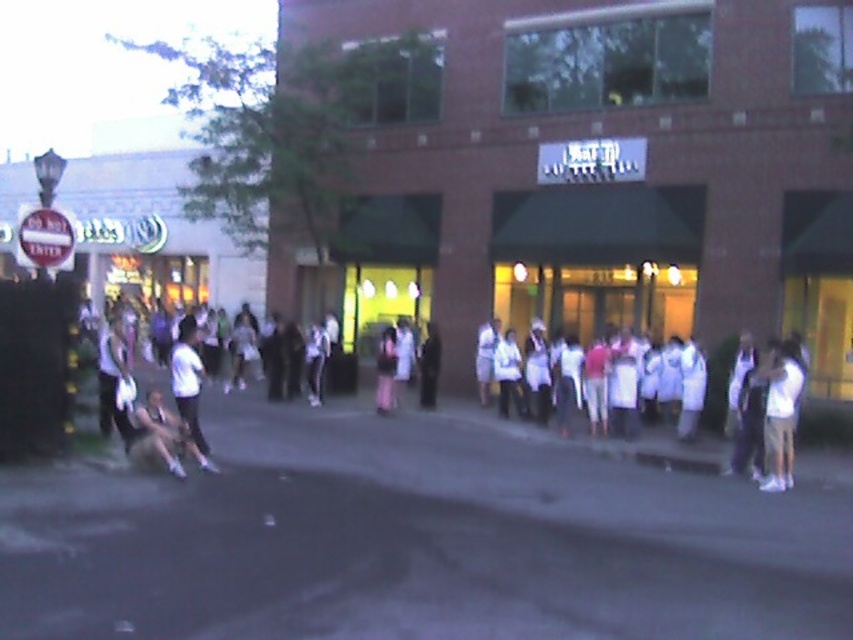
You are a photographer trying to capture a photo of the brick building at center and the white cotton shirt at center in the same frame. Which object should you focus on first to ensure both are in the frame?

Since the brick building at center is taller than the white cotton shirt at center, you should focus on the brick building at center first to ensure its full height is captured in the frame before adjusting for the white cotton shirt at center.

You are a photographer trying to capture a clear shot of both the white matte shirt at center and the white cotton shirt at center. Since the lighting is dim, you need to adjust your camera settings to ensure both are visible. Considering their sizes, which one might require more focus adjustments to avoid blurring?

The white matte shirt at center is larger in size than the white cotton shirt at center, so it might require more focus adjustments to avoid blurring due to its larger size.